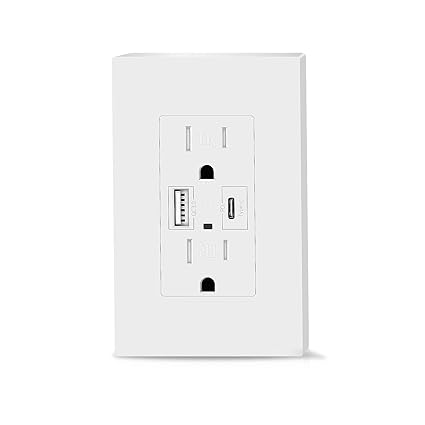
The height and width of the screenshot is (425, 425). I want to click on left corner, so click(x=120, y=67).